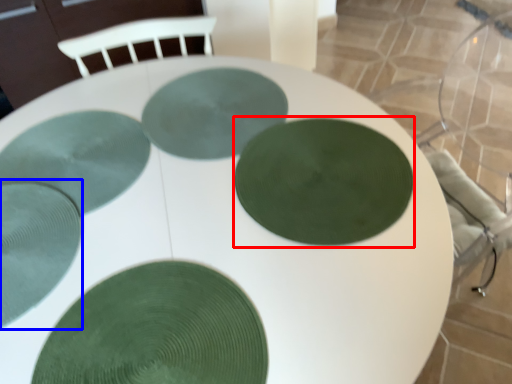
Question: Which object is closer to the camera taking this photo, glass plate (highlighted by a red box) or glass plate (highlighted by a blue box)?

Choices:
 (A) glass plate
 (B) glass plate

Answer: (B)